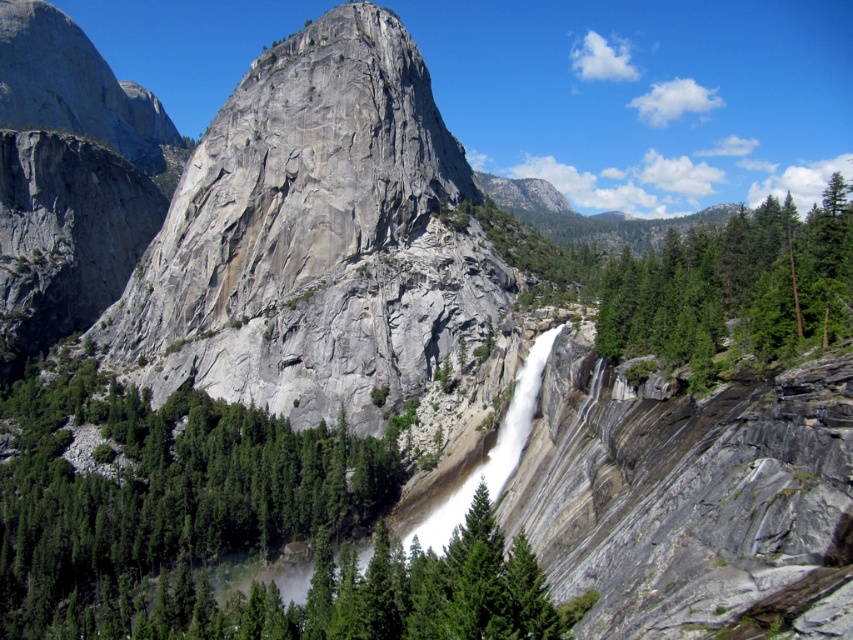
This screenshot has height=640, width=853. What are the coordinates of `green textured rock at center` in the screenshot? It's located at (158, 497).

Between green textured rock at center and green textured tree at center-right, which one appears on the right side from the viewer's perspective?

Positioned to the right is green textured tree at center-right.

Who is more forward, [242,508] or [770,296]?

Point [770,296] is in front.

Where is `green textured rock at center`? green textured rock at center is located at coordinates (158, 497).

Is point (438, 337) positioned before point (784, 282)?

No, (438, 337) is further to viewer.

Which is behind, point (183, 234) or point (772, 253)?

The point (183, 234) is behind.

Is point (252, 300) farther from viewer compared to point (817, 221)?

Yes, it is behind point (817, 221).

Image resolution: width=853 pixels, height=640 pixels. Identify the location of gray/rough rock at center. (315, 237).

Between gray/rough rock at center and green textured rock at center, which one appears on the left side from the viewer's perspective?

From the viewer's perspective, green textured rock at center appears more on the left side.

Does gray/rough rock at center have a larger size compared to green textured rock at center?

Yes, gray/rough rock at center is bigger than green textured rock at center.

The height and width of the screenshot is (640, 853). I want to click on gray/rough rock at center, so click(x=315, y=237).